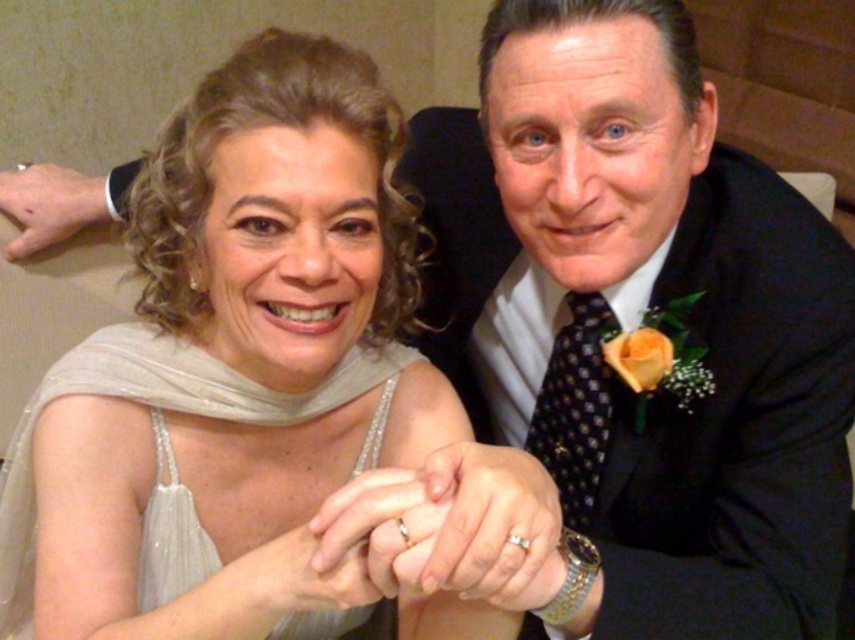
Which is more to the right, black satin suit at upper right or satin white dress at center?

black satin suit at upper right

Which is in front, point (671, 467) or point (98, 413)?

Point (98, 413) is in front.

Locate an element on the screen. black satin suit at upper right is located at coordinates (635, 326).